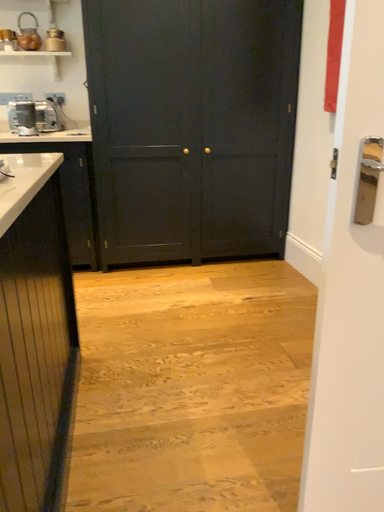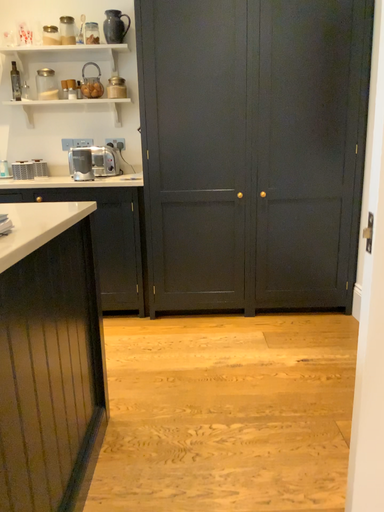
Question: Which way did the camera rotate in the video?

Choices:
 (A) rotated left
 (B) rotated right

Answer: (A)